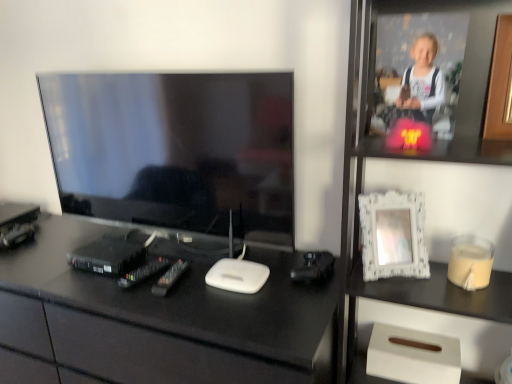
What do you see at coordinates (175, 149) in the screenshot? This screenshot has width=512, height=384. I see `matte black tv at left` at bounding box center [175, 149].

The height and width of the screenshot is (384, 512). What do you see at coordinates (425, 180) in the screenshot?
I see `white textured frame at upper right` at bounding box center [425, 180].

What do you see at coordinates (500, 84) in the screenshot? The image size is (512, 384). I see `wooden at upper right, which is counted as the second picture frame, starting from the bottom` at bounding box center [500, 84].

I want to click on matte black tv at left, so click(175, 149).

From a real-world perspective, who is located higher, wooden at upper right, the first picture frame viewed from the right, or white lace picture frame at upper right, which is the 1th picture frame from bottom to top?

In real-world perspective, wooden at upper right, the first picture frame viewed from the right, is above.

How different are the orientations of wooden at upper right, the second picture frame positioned from the left, and white lace picture frame at upper right, which is the 1th picture frame from bottom to top, in degrees?

The facing directions of wooden at upper right, the second picture frame positioned from the left, and white lace picture frame at upper right, which is the 1th picture frame from bottom to top, are 28.4 degrees apart.

From their relative heights in the image, would you say wooden at upper right, the first picture frame viewed from the right, is taller or shorter than white lace picture frame at upper right, which is the 1th picture frame from bottom to top?

Considering their sizes, wooden at upper right, the first picture frame viewed from the right, has more height than white lace picture frame at upper right, which is the 1th picture frame from bottom to top.

From the image's perspective, is wooden at upper right, the second picture frame positioned from the left, located above or below white lace picture frame at upper right, the second picture frame from the top?

Based on their image positions, wooden at upper right, the second picture frame positioned from the left, is located above white lace picture frame at upper right, the second picture frame from the top.

From the image's perspective, between wooden at upper right, the first picture frame viewed from the right, and beige matte candle at right, who is located below?

beige matte candle at right, from the image's perspective.

Is wooden at upper right, which is counted as the second picture frame, starting from the bottom, taller or shorter than beige matte candle at right?

wooden at upper right, which is counted as the second picture frame, starting from the bottom, is taller than beige matte candle at right.

Considering the positions of objects wooden at upper right, the second picture frame positioned from the left, and beige matte candle at right in the image provided, who is more to the left, wooden at upper right, the second picture frame positioned from the left, or beige matte candle at right?

From the viewer's perspective, beige matte candle at right appears more on the left side.

Could you measure the distance between wooden at upper right, which is counted as the second picture frame, starting from the bottom, and beige matte candle at right?

wooden at upper right, which is counted as the second picture frame, starting from the bottom, is 13.82 inches away from beige matte candle at right.

Is matte black tv at left far away from white lace picture frame at upper right, which is the 1th picture frame from bottom to top?

No, matte black tv at left is not far from white lace picture frame at upper right, which is the 1th picture frame from bottom to top.

Is matte black tv at left not inside white lace picture frame at upper right, the second picture frame from the top?

matte black tv at left is positioned outside white lace picture frame at upper right, the second picture frame from the top.

How distant is matte black tv at left from white lace picture frame at upper right, which is the 1th picture frame from bottom to top?

They are 21.84 inches apart.

Is matte black tv at left taller or shorter than white lace picture frame at upper right, the second picture frame from the top?

Considering their sizes, matte black tv at left has more height than white lace picture frame at upper right, the second picture frame from the top.

Could you tell me if beige matte candle at right is facing white textured frame at upper right?

Yes, beige matte candle at right is oriented towards white textured frame at upper right.

Considering the positions of objects beige matte candle at right and white textured frame at upper right in the image provided, who is more to the left, beige matte candle at right or white textured frame at upper right?

From the viewer's perspective, white textured frame at upper right appears more on the left side.

Is beige matte candle at right further to camera compared to white textured frame at upper right?

Yes.

From the picture: From a real-world perspective, is beige matte candle at right physically located above or below white textured frame at upper right?

beige matte candle at right is situated lower than white textured frame at upper right in the real world.

From the image's perspective, is white textured frame at upper right on wooden at upper right, the second picture frame positioned from the left?

No, from the image's perspective, white textured frame at upper right is not over wooden at upper right, the second picture frame positioned from the left.

Considering the sizes of white textured frame at upper right and wooden at upper right, the first picture frame positioned from the top, in the image, is white textured frame at upper right taller or shorter than wooden at upper right, the first picture frame positioned from the top,?

white textured frame at upper right is taller than wooden at upper right, the first picture frame positioned from the top.

How many degrees apart are the facing directions of white lace picture frame at upper right, which is the 1th picture frame from bottom to top, and white textured frame at upper right?

The facing directions of white lace picture frame at upper right, which is the 1th picture frame from bottom to top, and white textured frame at upper right are 29 degrees apart.

The height and width of the screenshot is (384, 512). I want to click on bookshelf below the white lace picture frame at upper right, which is the 1th picture frame from bottom to top (from the image's perspective), so click(x=425, y=180).

Considering the positions of objects white lace picture frame at upper right, which is counted as the second picture frame, starting from the right, and white textured frame at upper right in the image provided, who is behind, white lace picture frame at upper right, which is counted as the second picture frame, starting from the right, or white textured frame at upper right?

Positioned behind is white lace picture frame at upper right, which is counted as the second picture frame, starting from the right.

Is white lace picture frame at upper right, positioned as the first picture frame in left-to-right order, wider or thinner than white textured frame at upper right?

Clearly, white lace picture frame at upper right, positioned as the first picture frame in left-to-right order, has less width compared to white textured frame at upper right.

Image resolution: width=512 pixels, height=384 pixels. In order to click on picture frame that appears above the white lace picture frame at upper right, the second picture frame from the top (from a real-world perspective) in this screenshot , I will do `click(500, 84)`.

Is point (368, 272) closer to viewer compared to point (509, 53)?

No, (368, 272) is further to viewer.

From a real-world perspective, which object rests below the other?

In real-world perspective, white lace picture frame at upper right, which is counted as the second picture frame, starting from the right, is lower.

Consider the image. Looking at the image, does white lace picture frame at upper right, which is the 1th picture frame from bottom to top, seem bigger or smaller compared to wooden at upper right, the first picture frame positioned from the top?

white lace picture frame at upper right, which is the 1th picture frame from bottom to top, is smaller than wooden at upper right, the first picture frame positioned from the top.

At what (x,y) coordinates should I click in order to perform the action: click on picture frame above the white lace picture frame at upper right, positioned as the first picture frame in left-to-right order (from the image's perspective). Please return your answer as a coordinate pair (x, y). Looking at the image, I should click on (500, 84).

I want to click on candle holder lying below the wooden at upper right, the first picture frame viewed from the right (from the image's perspective), so click(470, 262).

Considering their positions, is matte black tv at left positioned closer to black glossy desk at center than white textured frame at upper right?

The object closer to black glossy desk at center is matte black tv at left.

From the image, which object appears to be nearer to beige matte candle at right, white lace picture frame at upper right, which is counted as the second picture frame, starting from the right, or matte black tv at left?

white lace picture frame at upper right, which is counted as the second picture frame, starting from the right.

Considering their positions, is white textured frame at upper right positioned further to wooden at upper right, which is counted as the second picture frame, starting from the bottom, than beige matte candle at right?

Based on the image, beige matte candle at right appears to be further to wooden at upper right, which is counted as the second picture frame, starting from the bottom.

Estimate the real-world distances between objects in this image. Which object is further from black glossy desk at center, beige matte candle at right or matte black tv at left?

Among the two, beige matte candle at right is located further to black glossy desk at center.

Estimate the real-world distances between objects in this image. Which object is further from beige matte candle at right, wooden at upper right, the first picture frame viewed from the right, or white lace picture frame at upper right, which is the 1th picture frame from bottom to top?

wooden at upper right, the first picture frame viewed from the right, is positioned further to the anchor beige matte candle at right.

Considering their positions, is black glossy desk at center positioned further to wooden at upper right, which is counted as the second picture frame, starting from the bottom, than matte black tv at left?

The object further to wooden at upper right, which is counted as the second picture frame, starting from the bottom, is black glossy desk at center.

Considering their positions, is beige matte candle at right positioned closer to white textured frame at upper right than white lace picture frame at upper right, positioned as the first picture frame in left-to-right order?

The object closer to white textured frame at upper right is white lace picture frame at upper right, positioned as the first picture frame in left-to-right order.

In the scene shown: Looking at the image, which one is located closer to matte black tv at left, white textured frame at upper right or white lace picture frame at upper right, the second picture frame from the top?

Among the two, white textured frame at upper right is located nearer to matte black tv at left.

Locate an element on the screen. The height and width of the screenshot is (384, 512). picture frame located between matte black tv at left and beige matte candle at right in the left-right direction is located at coordinates (393, 235).

Where is `candle holder between black glossy desk at center and wooden at upper right, the first picture frame viewed from the right, from left to right`? candle holder between black glossy desk at center and wooden at upper right, the first picture frame viewed from the right, from left to right is located at coordinates (470, 262).

You are a GUI agent. You are given a task and a screenshot of the screen. Output one action in this format:
    pyautogui.click(x=<x>, y=<y>)
    Task: Click on the bookshelf located between matte black tv at left and beige matte candle at right in the left-right direction
    
    Given the screenshot: What is the action you would take?
    pyautogui.click(x=425, y=180)

The height and width of the screenshot is (384, 512). Identify the location of picture frame between black glossy desk at center and white textured frame at upper right from left to right. (393, 235).